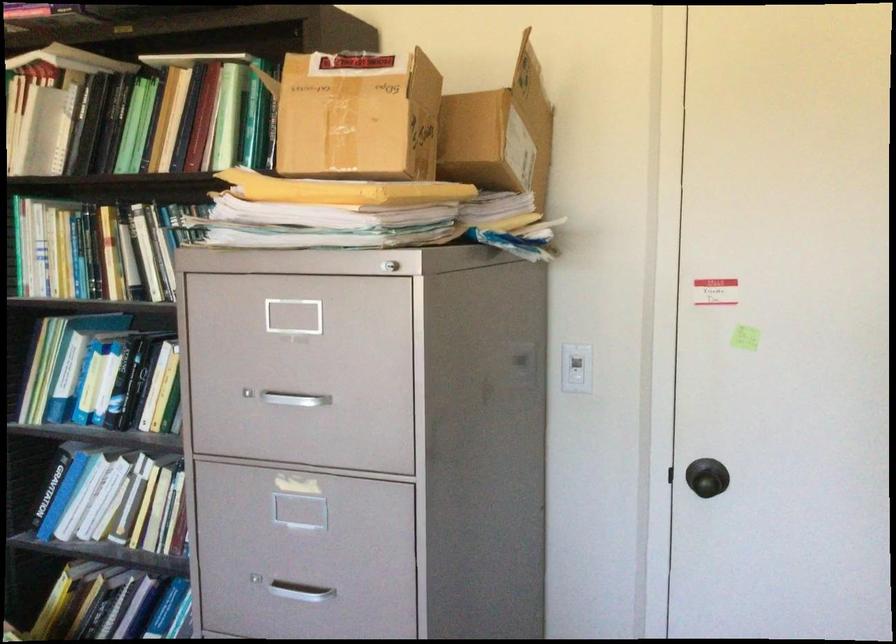
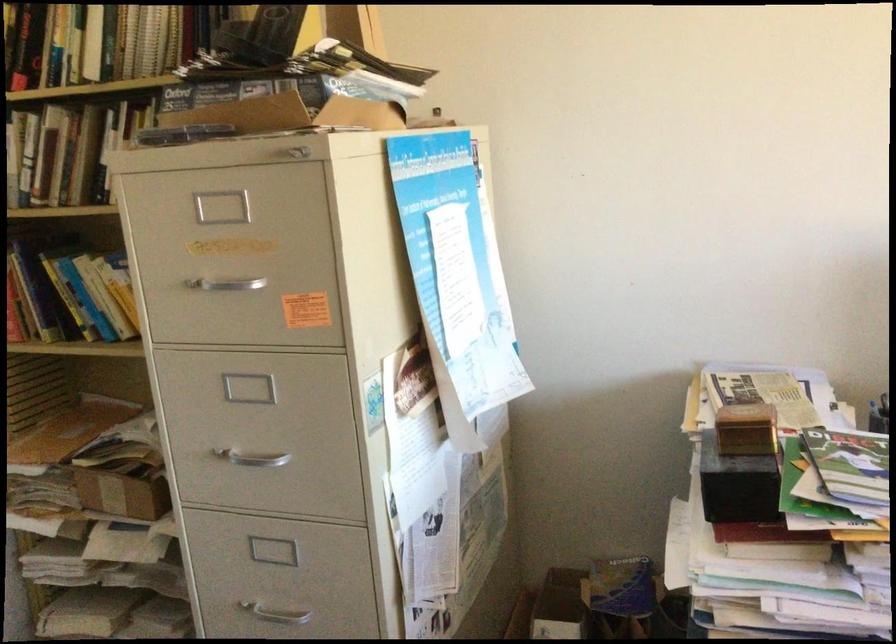
Question: The first image is from the beginning of the video and the second image is from the end. How did the camera likely rotate when shooting the video?

Choices:
 (A) Left
 (B) Right
 (C) Up
 (D) Down

Answer: (B)